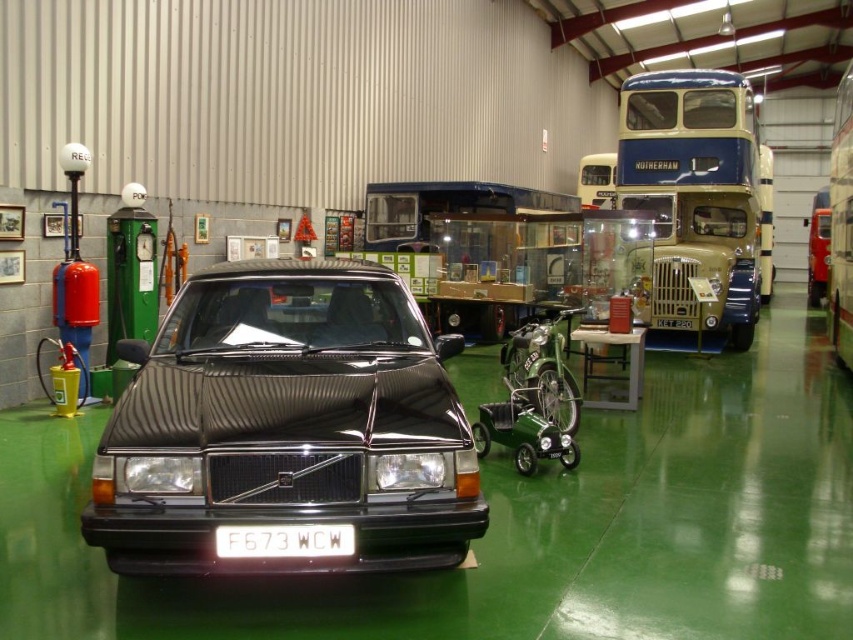
Between point (175, 380) and point (345, 550), which one is positioned in front?

Point (345, 550) is in front.

Does shiny black car at center lie behind white plastic license plate at center?

That is True.

Find the location of `shiny black car at center`. shiny black car at center is located at coordinates (287, 426).

Is blue/yellow painted metal/decorative double-decker bus at upper right wider than white plastic license plate at center?

Indeed, blue/yellow painted metal/decorative double-decker bus at upper right has a greater width compared to white plastic license plate at center.

Locate an element on the screen. This screenshot has height=640, width=853. blue/yellow painted metal/decorative double-decker bus at upper right is located at coordinates (695, 195).

Between shiny black car at center and blue/yellow painted metal/decorative double-decker bus at upper right, which one has less height?

shiny black car at center is shorter.

How distant is shiny black car at center from blue/yellow painted metal/decorative double-decker bus at upper right?

shiny black car at center is 32.98 feet away from blue/yellow painted metal/decorative double-decker bus at upper right.

Measure the distance between point (138, 396) and camera.

Point (138, 396) is 4.32 meters away from camera.

Identify the location of shiny black car at center. (287, 426).